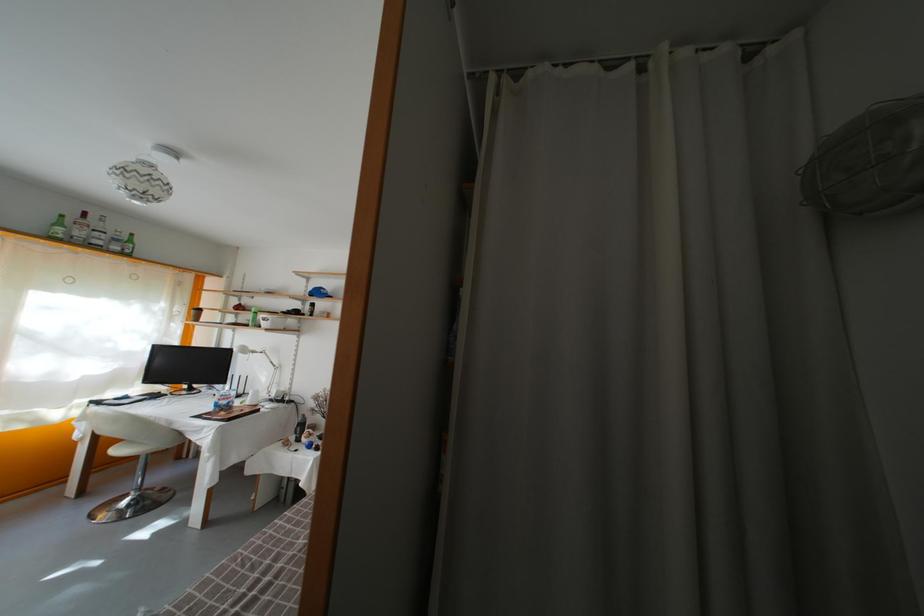
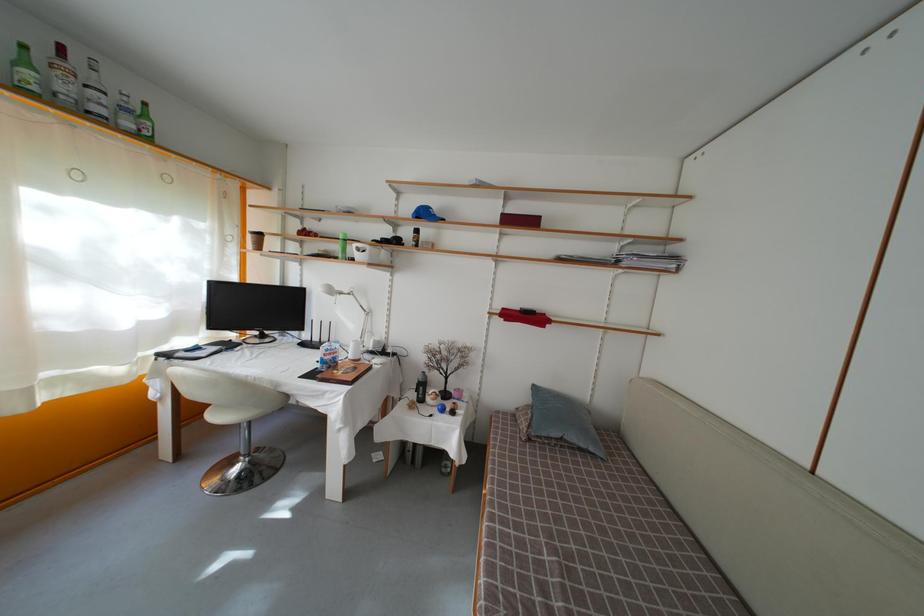
In the second image, find the point that corresponds to point (84, 240) in the first image.

(69, 95)